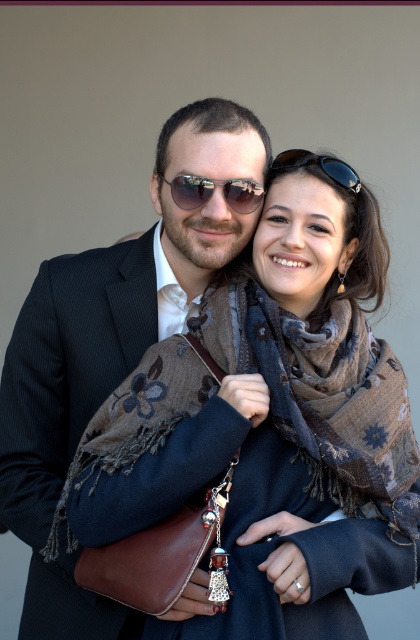
Which is more to the left, matte black sunglasses at center or black reflective sunglasses at upper center?

matte black sunglasses at center

Between matte black sunglasses at center and black reflective sunglasses at upper center, which one appears on the right side from the viewer's perspective?

black reflective sunglasses at upper center is more to the right.

Does point (176, 204) come farther from viewer compared to point (330, 166)?

No, it is in front of (330, 166).

Where is `matte black sunglasses at center`? This screenshot has width=420, height=640. matte black sunglasses at center is located at coordinates (212, 189).

Who is positioned more to the right, brown textured scarf at center or matte black sunglasses at center?

Positioned to the right is brown textured scarf at center.

Is brown textured scarf at center bigger than matte black sunglasses at center?

Correct, brown textured scarf at center is larger in size than matte black sunglasses at center.

Which is in front, point (299, 401) or point (199, 186)?

Point (299, 401)

Locate an element on the screen. The height and width of the screenshot is (640, 420). brown textured scarf at center is located at coordinates (338, 404).

Is brown textured scarf at center to the left of black reflective sunglasses at upper center from the viewer's perspective?

Incorrect, brown textured scarf at center is not on the left side of black reflective sunglasses at upper center.

Can you confirm if brown textured scarf at center is taller than black reflective sunglasses at upper center?

Indeed, brown textured scarf at center has a greater height compared to black reflective sunglasses at upper center.

Who is more forward, (x=259, y=321) or (x=296, y=163)?

Point (x=259, y=321) is more forward.

You are a GUI agent. You are given a task and a screenshot of the screen. Output one action in this format:
    pyautogui.click(x=<x>, y=<y>)
    Task: Click on the brown textured scarf at center
    This screenshot has width=420, height=640.
    Given the screenshot: What is the action you would take?
    pyautogui.click(x=338, y=404)